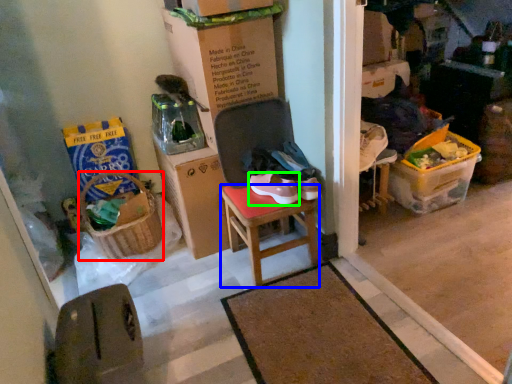
Question: Which is nearer to the picnic basket (highlighted by a red box)? stool (highlighted by a blue box) or footwear (highlighted by a green box).

Choices:
 (A) stool
 (B) footwear

Answer: (A)